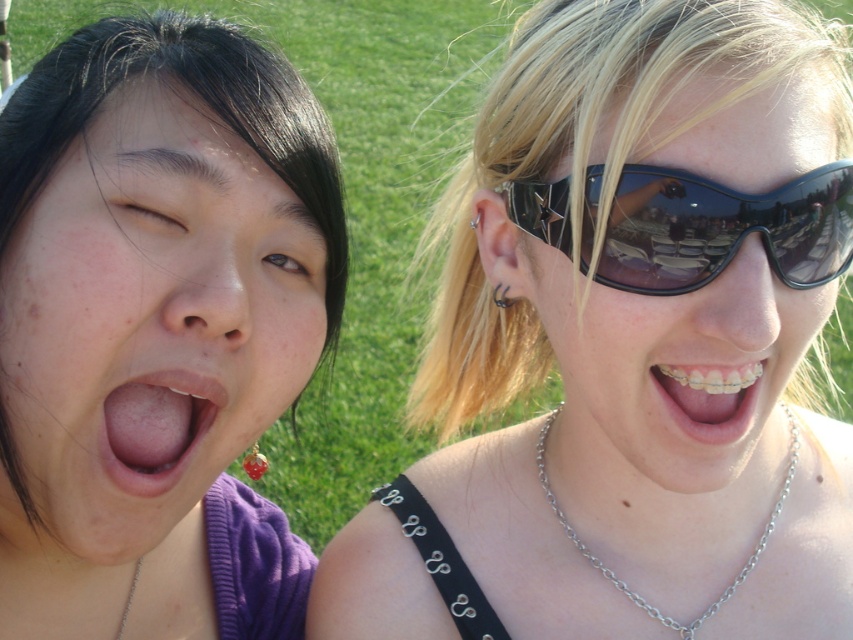
Question: Which object appears farthest from the camera in this image?

Choices:
 (A) metallic braces at center
 (B) black shiny sunglasses at upper right
 (C) smooth skin face at left

Answer: (A)

Question: In this image, where is smooth skin face at left located relative to silver chain necklace at center?

Choices:
 (A) above
 (B) below

Answer: (A)

Question: Does smooth skin face at left appear on the right side of black reflective sunglasses at upper right?

Choices:
 (A) yes
 (B) no

Answer: (B)

Question: Among these objects, which one is farthest from the camera?

Choices:
 (A) smooth skin face at left
 (B) shiny black sunglasses at right
 (C) silver chain necklace at center
 (D) metallic braces at center

Answer: (C)

Question: Based on their relative distances, which object is nearer to the black metal ring at ear?

Choices:
 (A) black reflective sunglasses at upper right
 (B) metallic braces at center
 (C) pink smooth lips at lower left
 (D) black shiny sunglasses at upper right

Answer: (D)

Question: Can you confirm if shiny black sunglasses at right is wider than metallic braces at center?

Choices:
 (A) no
 (B) yes

Answer: (B)